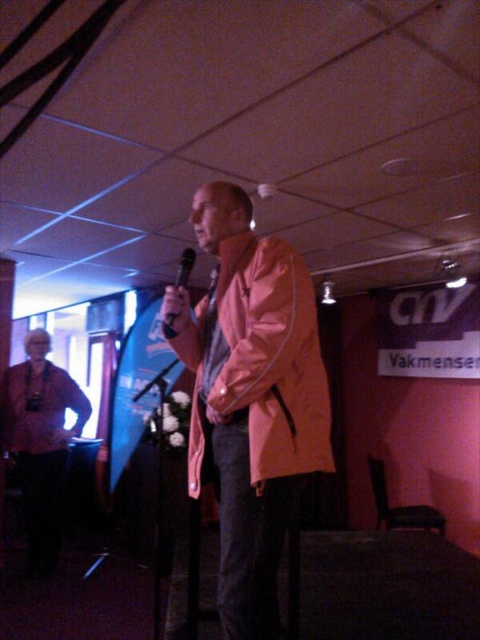
You are a photographer positioned behind the camera and want to capture a shot where the orange matte jacket at center is clearly visible to the right of the black matte microphone at center. Is this possible based on the scene description?

Yes, because the orange matte jacket at center is to the right of the black matte microphone at center, so positioning the camera to frame the jacket on the right side of the microphone would achieve the desired composition.

You are a photographer setting up for a live event. You need to position your camera so that both the orange matte jacket at center and the black matte microphone at center are in frame. Given their sizes, which object should you ensure is closer to the camera to maintain both in focus without adjusting the focal length?

The orange matte jacket at center is much taller than the black matte microphone at center. To keep both in focus, you should position the orange matte jacket at center closer to the camera since it is larger and requires more focus area.

You are a photographer setting up for an event. You need to ensure that the orange matte jacket at center and the black matte microphone at center are both visible in your photo. Given their sizes, which object should you focus on first to ensure both are in frame?

The orange matte jacket at center is bigger than the black matte microphone at center, so you should focus on the orange matte jacket at center first to ensure it fits within the frame, as it requires more space.